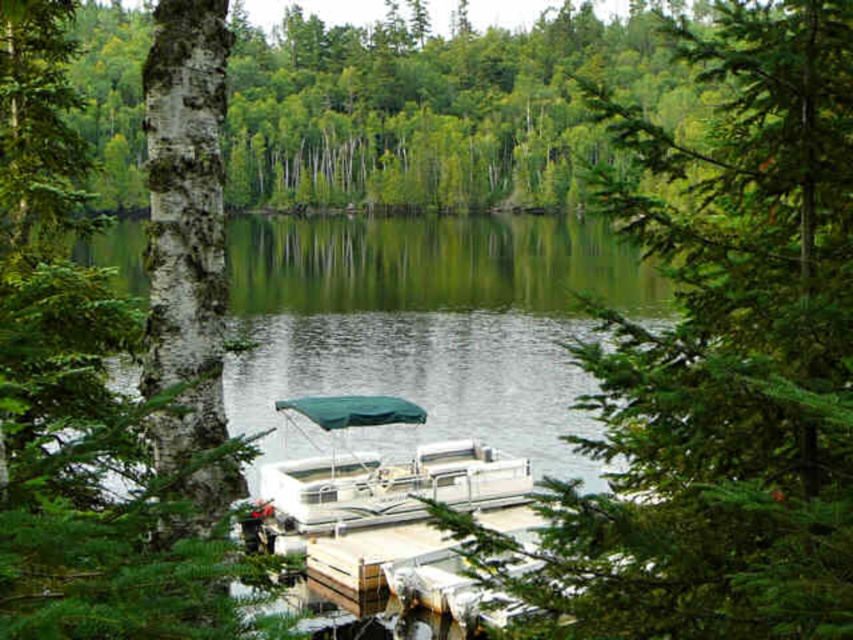
Can you confirm if green matte tree at center is taller than white plastic pontoon boat at center?

Yes.

Is green matte tree at center positioned at the back of white plastic pontoon boat at center?

No, green matte tree at center is closer to the viewer.

This screenshot has width=853, height=640. What do you see at coordinates (723, 356) in the screenshot?
I see `green matte tree at center` at bounding box center [723, 356].

This screenshot has height=640, width=853. Find the location of `green matte tree at center`. green matte tree at center is located at coordinates (723, 356).

What are the coordinates of `white bark tree at left` in the screenshot? It's located at (113, 355).

Based on the photo, is white bark tree at left shorter than white plastic pontoon boat at center?

No.

The height and width of the screenshot is (640, 853). I want to click on white bark tree at left, so click(x=113, y=355).

This screenshot has width=853, height=640. Identify the location of white bark tree at left. (113, 355).

Measure the distance between white bark tree at left and green smooth water at center.

white bark tree at left and green smooth water at center are 135.72 feet apart.

Between white bark tree at left and green smooth water at center, which one appears on the right side from the viewer's perspective?

Positioned to the right is green smooth water at center.

Where is `white bark tree at left`? white bark tree at left is located at coordinates (113, 355).